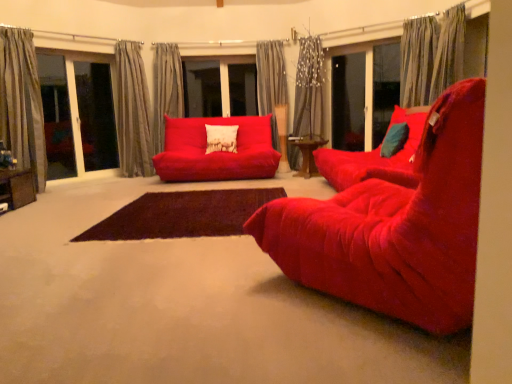
Question: Is velvet red studio couch at center a part of gray textured curtain at center, the fifth curtain viewed from the left?

Choices:
 (A) no
 (B) yes

Answer: (A)

Question: Are gray textured curtain at center, marked as the second curtain in a right-to-left arrangement, and velvet red studio couch at center located far from each other?

Choices:
 (A) yes
 (B) no

Answer: (A)

Question: Considering the relative sizes of gray textured curtain at center, the fifth curtain viewed from the left, and velvet red studio couch at center in the image provided, is gray textured curtain at center, the fifth curtain viewed from the left, smaller than velvet red studio couch at center?

Choices:
 (A) yes
 (B) no

Answer: (A)

Question: Could you tell me if gray textured curtain at center, marked as the second curtain in a right-to-left arrangement, is facing velvet red studio couch at center?

Choices:
 (A) no
 (B) yes

Answer: (B)

Question: From the image's perspective, is gray textured curtain at center, the fifth curtain viewed from the left, on top of velvet red studio couch at center?

Choices:
 (A) yes
 (B) no

Answer: (A)

Question: Would you say gray striped curtain at left, which is the 1th curtain in left-to-right order, is inside or outside wooden table at lower left, which ranks as the second table in back-to-front order?

Choices:
 (A) outside
 (B) inside

Answer: (A)

Question: Relative to wooden table at lower left, which is counted as the 1th table, starting from the left, is gray striped curtain at left, the sixth curtain from the right, in front or behind?

Choices:
 (A) front
 (B) behind

Answer: (B)

Question: From the image's perspective, is gray striped curtain at left, the sixth curtain from the right, positioned above or below wooden table at lower left, which is counted as the first table, starting from the bottom?

Choices:
 (A) above
 (B) below

Answer: (A)

Question: Considering the relative positions of gray striped curtain at left, which is the 1th curtain in left-to-right order, and wooden table at lower left, the second table from the right, in the image provided, is gray striped curtain at left, which is the 1th curtain in left-to-right order, to the left or to the right of wooden table at lower left, the second table from the right,?

Choices:
 (A) left
 (B) right

Answer: (A)

Question: Based on their positions, is teal velvet pillow at right, which is counted as the 1th pillow, starting from the right, located to the left or right of velvet cushion at center, marked as the first pillow in a left-to-right arrangement?

Choices:
 (A) left
 (B) right

Answer: (B)

Question: Is point (393, 127) closer or farther from the camera than point (211, 147)?

Choices:
 (A) farther
 (B) closer

Answer: (B)

Question: From a real-world perspective, relative to velvet cushion at center, which appears as the 2th pillow when viewed from the front, is teal velvet pillow at right, positioned as the 1th pillow in front-to-back order, vertically above or below?

Choices:
 (A) below
 (B) above

Answer: (A)

Question: From the image's perspective, is teal velvet pillow at right, which is the 2th pillow in left-to-right order, located above or below velvet cushion at center, placed as the second pillow when sorted from right to left?

Choices:
 (A) below
 (B) above

Answer: (A)

Question: Based on their sizes in the image, would you say transparent glass screen door at center, arranged as the first screen door when viewed from the left, is bigger or smaller than velvet red chair at center?

Choices:
 (A) big
 (B) small

Answer: (B)

Question: Which is correct: transparent glass screen door at center, arranged as the first screen door when viewed from the left, is inside velvet red chair at center, or outside of it?

Choices:
 (A) outside
 (B) inside

Answer: (A)